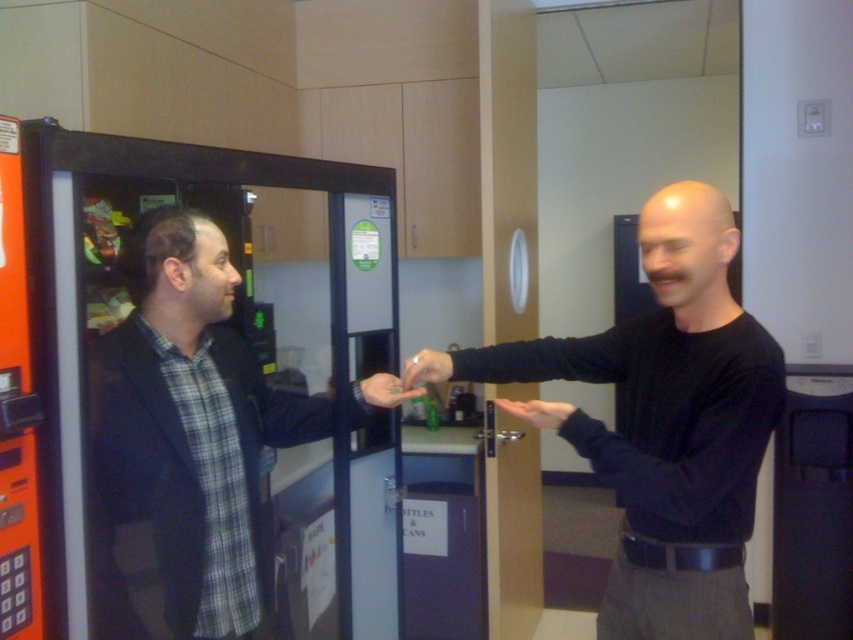
Consider the image. You are standing in the room and see two points marked in the image. Which point is closer to you, point (497,403) or point (408,369)?

Point (408,369) is closer to you because it is in front of point (497,403).

You are an office security camera observing the scene. You notice the plaid shirt at left and the matte plastic hand at center. Which object is positioned farther to the left?

The plaid shirt at left is positioned farther to the left than the matte plastic hand at center.